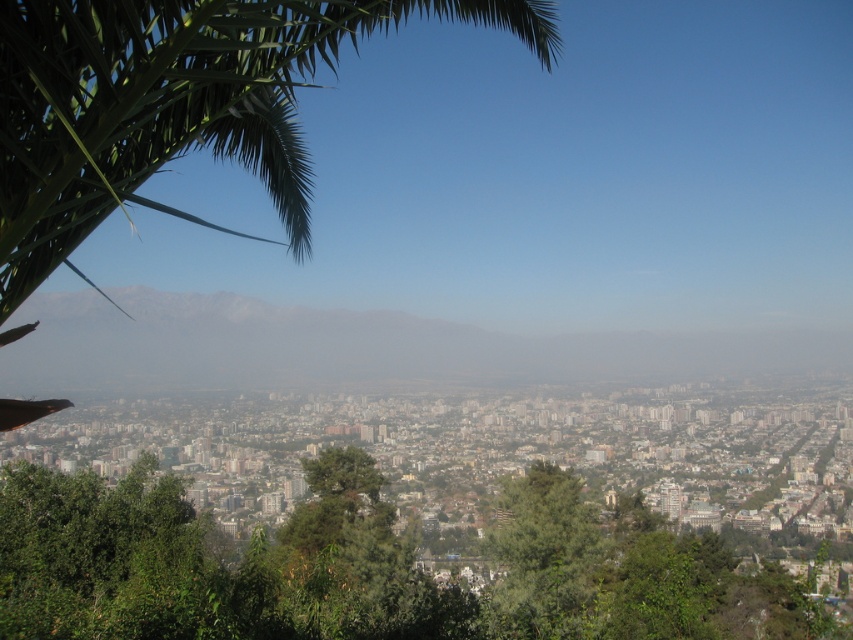
You are a drone operator tasked with capturing aerial footage of the green leafy palm tree at upper left and the gray foggy mountain at center. Your drone has a maximum flight range of 150 meters. Can you fly your drone from the palm tree to the mountain without exceeding its range?

The distance between the green leafy palm tree at upper left and the gray foggy mountain at center is 134.40 meters, which is within the drone operator drone maximum flight range of 150 meters. The drone can safely fly from the palm tree to the mountain without exceeding its range.

Looking at this image, you are an urban planner analyzing the city layout. You notice the gray foggy mountain at center and the green textured tree at center. Which one is located to the left of the other?

The gray foggy mountain at center is positioned on the left side of green textured tree at center.

You are standing in the city and looking at the image. There is a point marked at coordinates point (173, 104). What object in the scene is this point located on?

The point (173, 104) is located on the green leafy palm tree at upper left.